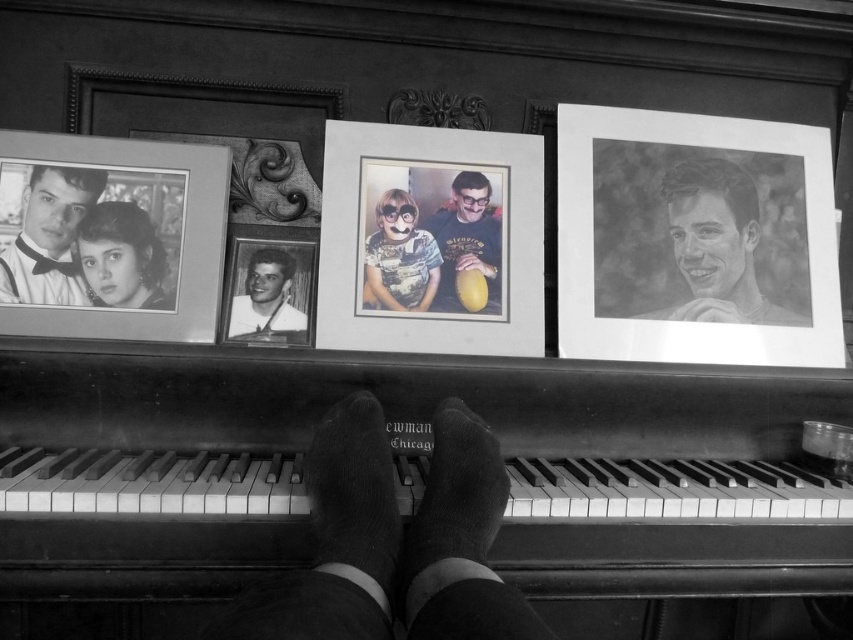
Question: Based on their relative distances, which object is farther from the black wool socks at center?

Choices:
 (A) socks at center
 (B) matte plastic person at center
 (C) black polished piano at center

Answer: (B)

Question: Which point is closer to the camera?

Choices:
 (A) (260, 412)
 (B) (476, 428)

Answer: (B)

Question: Is matte plastic picture frame at center positioned at the back of smooth paper portrait at upper right?

Choices:
 (A) no
 (B) yes

Answer: (A)

Question: Can you confirm if socks at center is positioned above black wool socks at center?

Choices:
 (A) yes
 (B) no

Answer: (B)

Question: Which of the following is the farthest from the observer?

Choices:
 (A) smooth black hair at left
 (B) matte plastic picture frame at center
 (C) camouflage-patterned shirt at center
 (D) black polished piano at center

Answer: (C)

Question: From the image, what is the correct spatial relationship of smooth paper portrait at right in relation to matte plastic person at center?

Choices:
 (A) left
 (B) right

Answer: (B)